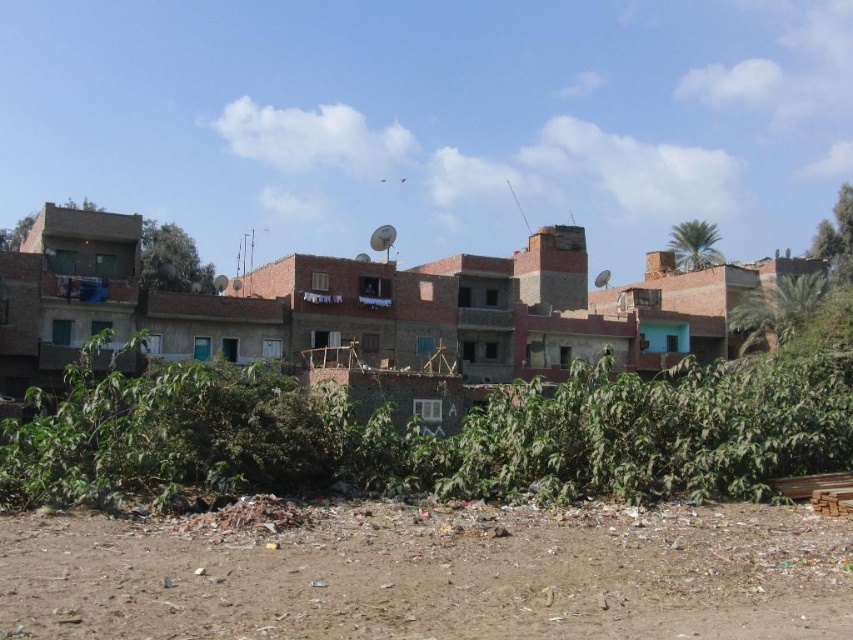
You are a gardener standing in front of the brown dirt field at lower center and the green leafy plants at center. Which area would you need to walk towards first to reach the plants?

The green leafy plants at center are further away from the viewer than the brown dirt field at lower center, so you would need to walk towards the green leafy plants at center first to reach them.

You are a city planner analyzing this area. You need to determine which area is smaller in size between the brown dirt field at lower center and the green leafy plants at center. Which one is smaller?

The brown dirt field at lower center is smaller in size compared to the green leafy plants at center.